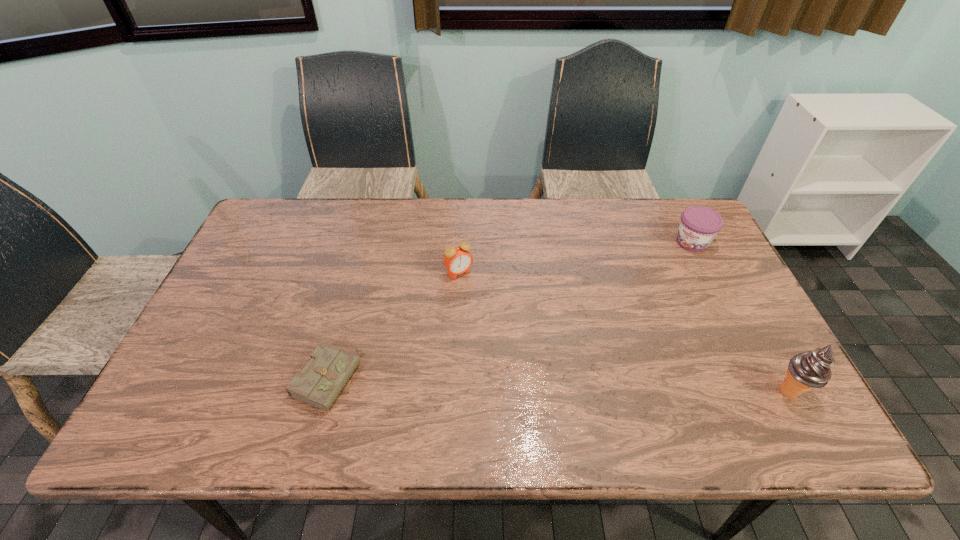
This screenshot has height=540, width=960. In order to click on object present at the far right corner in this screenshot , I will do `click(699, 225)`.

Locate an element on the screen. object present at the near right corner is located at coordinates (807, 370).

This screenshot has height=540, width=960. I want to click on vacant area at the far edge of the desktop, so click(404, 221).

Locate an element on the screen. Image resolution: width=960 pixels, height=540 pixels. blank area at the near edge is located at coordinates (544, 374).

In the image, there is a desktop. Where is `free space at the right edge`? free space at the right edge is located at coordinates (715, 313).

The image size is (960, 540). I want to click on vacant space at the far left corner of the desktop, so click(264, 233).

In the image, there is a desktop. Identify the location of free space at the near right corner. (761, 376).

I want to click on free space between the diary and the icecream, so click(559, 385).

Image resolution: width=960 pixels, height=540 pixels. I want to click on unoccupied position between the icecream and the farthest object, so click(741, 316).

The image size is (960, 540). What are the coordinates of `free space between the alarm clock and the tallest object` in the screenshot? It's located at (624, 332).